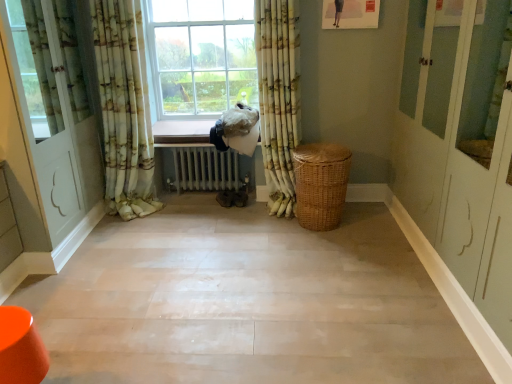
Question: Looking at the image, does smooth beige floor at center seem bigger or smaller compared to floral fabric curtain at left, which ranks as the first curtain in left-to-right order?

Choices:
 (A) big
 (B) small

Answer: (A)

Question: From a real-world perspective, is smooth beige floor at center positioned above or below floral fabric curtain at left, which appears as the 2th curtain when viewed from the right?

Choices:
 (A) above
 (B) below

Answer: (B)

Question: Based on their relative distances, which object is farther from the smooth beige floor at center?

Choices:
 (A) metallic radiator at center
 (B) white glossy door at left
 (C) woven brown basket at center-right
 (D) floral fabric curtain at center, acting as the 2th curtain starting from the left
 (E) floral fabric curtain at left, which appears as the 2th curtain when viewed from the right

Answer: (A)

Question: Based on their relative distances, which object is nearer to the floral fabric curtain at left, which appears as the 2th curtain when viewed from the right?

Choices:
 (A) floral fabric curtain at center, positioned as the 1th curtain in right-to-left order
 (B) metallic radiator at center
 (C) woven brown basket at center-right
 (D) smooth beige floor at center
 (E) white glossy door at left

Answer: (E)